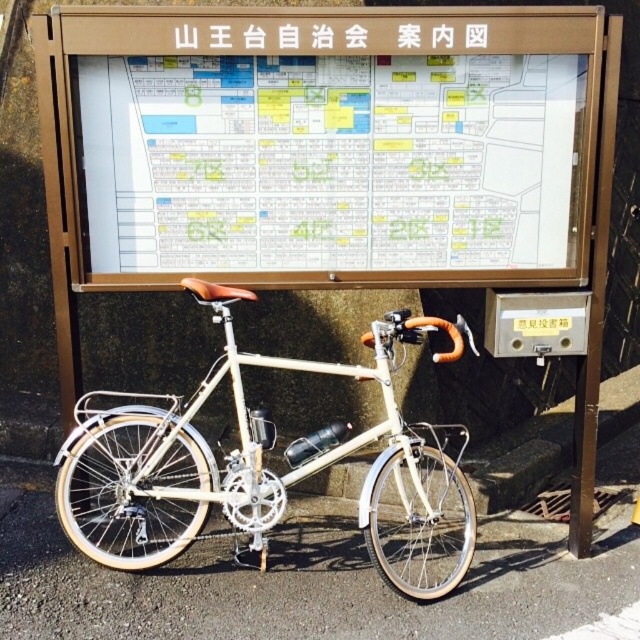
From the picture: You are a delivery person trying to park your matte cream bicycle at center between two other bikes. The space between the two bikes is exactly the width of the white plastic sign at upper center. Will your bicycle fit in the space?

The matte cream bicycle at center might be wider than the white plastic sign at upper center, so there is a possibility it will not fit in the space between the two bikes.

You are standing in front of a vintage bicycle and an informational board. There is a point marked at coordinates (328, 145). Which object is this point located on?

The point marked at coordinates (328, 145) is located on the wooden signboard at upper center.

You are standing at the camera position and want to reach the point marked at coordinates (413, 28). Given that the distance is 12.14 feet, how many steps would you need to take if each step covers approximately 2.5 feet?

The point marked at coordinates (413, 28) is 12.14 feet away from you. Since each step covers about 2.5 feet, you would need approximately 5 steps to reach it.